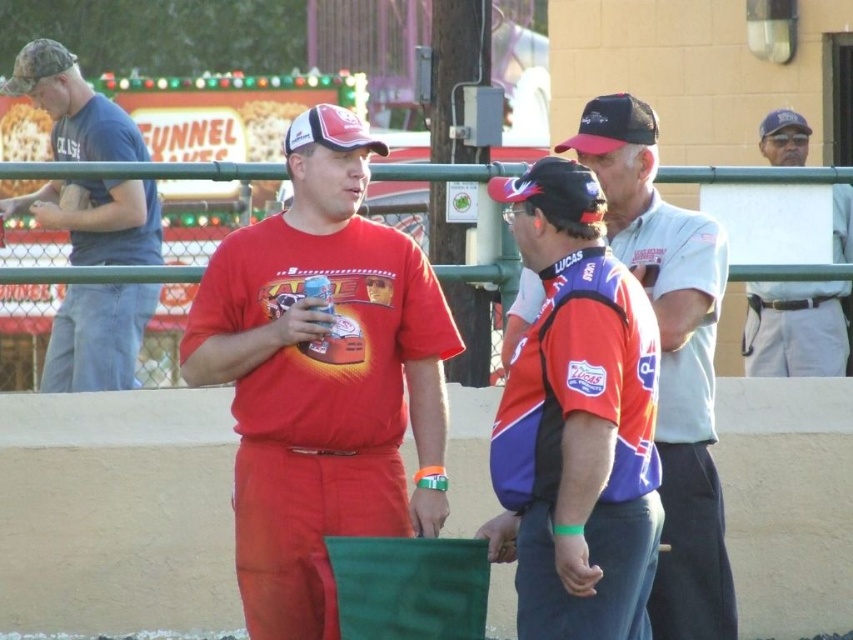
Does red polyester jersey at center appear on the left side of black mesh baseball cap at upper center?

Yes, red polyester jersey at center is to the left of black mesh baseball cap at upper center.

Can you confirm if red polyester jersey at center is bigger than black mesh baseball cap at upper center?

Yes, red polyester jersey at center is bigger than black mesh baseball cap at upper center.

This screenshot has width=853, height=640. Find the location of `red polyester jersey at center`. red polyester jersey at center is located at coordinates (572, 451).

Find the location of a particular element. Image resolution: width=853 pixels, height=640 pixels. red polyester jersey at center is located at coordinates (572, 451).

Who is positioned more to the right, gray fabric cap at upper right or white matte baseball cap at center?

Positioned to the right is gray fabric cap at upper right.

Locate an element on the screen. gray fabric cap at upper right is located at coordinates (795, 328).

Who is positioned more to the left, gray fabric cap at upper right or black fabric baseball cap at upper right?

gray fabric cap at upper right

You are a GUI agent. You are given a task and a screenshot of the screen. Output one action in this format:
    pyautogui.click(x=<x>, y=<y>)
    Task: Click on the gray fabric cap at upper right
    The height and width of the screenshot is (640, 853).
    Given the screenshot: What is the action you would take?
    pyautogui.click(x=795, y=328)

Does point (779, 122) come in front of point (788, 112)?

Yes, it is.

In order to click on gray fabric cap at upper right in this screenshot , I will do `click(795, 328)`.